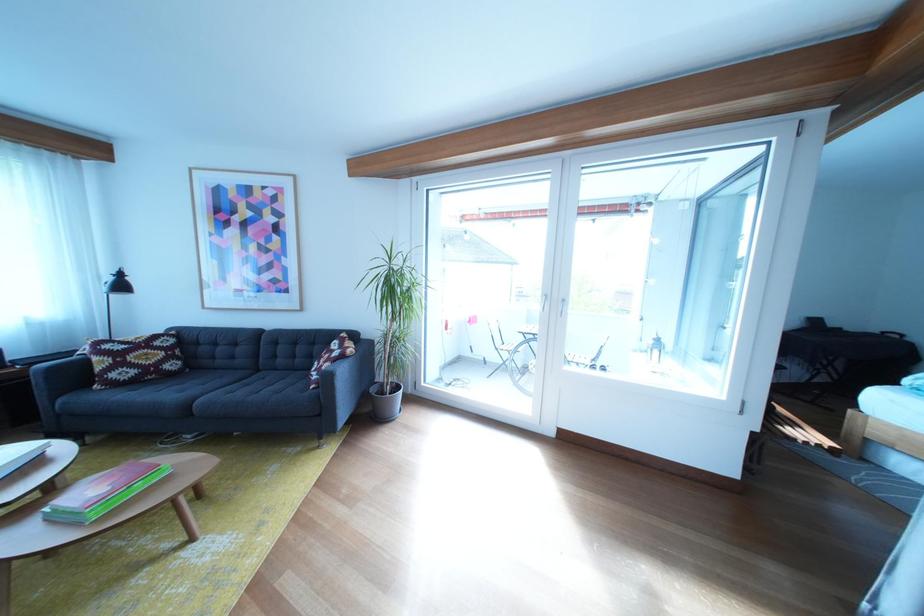
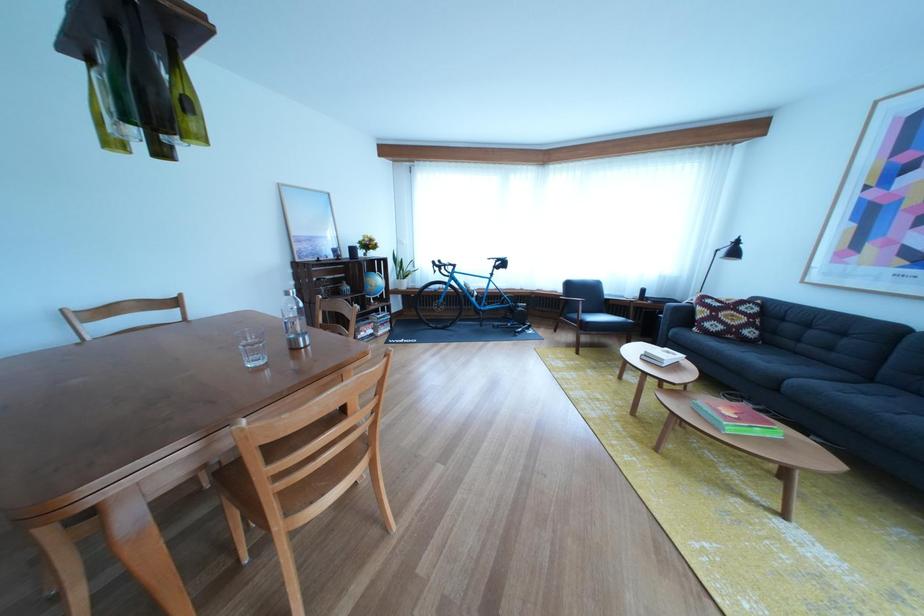
Locate, in the second image, the point that corresponds to the point at 184,381 in the first image.

(758, 347)